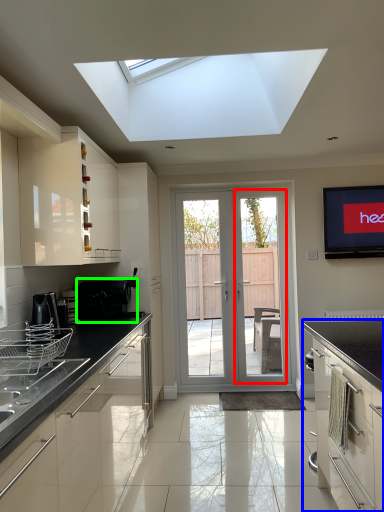
Question: Which is nearer to the screen door (highlighted by a red box)? cabinetry (highlighted by a blue box) or appliance (highlighted by a green box).

Choices:
 (A) cabinetry
 (B) appliance

Answer: (B)